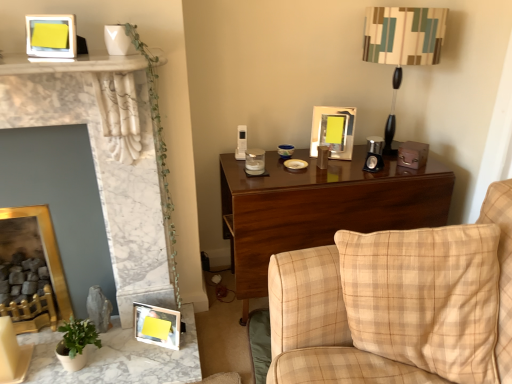
Measure the distance between point (167,313) and camera.

Point (167,313) and camera are 6.00 feet apart from each other.

This screenshot has height=384, width=512. What do you see at coordinates (402, 45) in the screenshot? I see `striped fabric lampshade at upper right` at bounding box center [402, 45].

At what (x,y) coordinates should I click in order to perform the action: click on marble table at lower left. Please return your answer as a coordinate pair (x, y). This screenshot has height=384, width=512. Looking at the image, I should click on (118, 358).

Where is `beige plaid fabric couch at right`? The width and height of the screenshot is (512, 384). beige plaid fabric couch at right is located at coordinates (396, 303).

Where is `metallic silver picture frame at upper center, the 2th picture frame positioned from the top`? The width and height of the screenshot is (512, 384). metallic silver picture frame at upper center, the 2th picture frame positioned from the top is located at coordinates (333, 131).

The width and height of the screenshot is (512, 384). In order to click on wooden photo frame at lower left, arranged as the first picture frame when ordered from the bottom in this screenshot , I will do `click(157, 325)`.

Is white marble fireplace at left next to marble table at lower left?

white marble fireplace at left and marble table at lower left are clearly separated.

In terms of height, does white marble fireplace at left look taller or shorter compared to marble table at lower left?

Clearly, white marble fireplace at left is taller compared to marble table at lower left.

What's the angular difference between white marble fireplace at left and marble table at lower left's facing directions?

white marble fireplace at left and marble table at lower left are facing 0.075 degrees away from each other.

Choose the correct answer: Is white marble fireplace at left inside marble table at lower left or outside it?

white marble fireplace at left is outside marble table at lower left.

Which object is further away from the camera, green leafy plant at upper left or striped fabric lampshade at upper right?

striped fabric lampshade at upper right is further away from the camera.

Is green leafy plant at upper left wider than striped fabric lampshade at upper right?

Incorrect, the width of green leafy plant at upper left does not surpass that of striped fabric lampshade at upper right.

Based on the photo, from the image's perspective, which object appears higher, green leafy plant at upper left or striped fabric lampshade at upper right?

striped fabric lampshade at upper right.

Is green leafy plant at upper left next to gold/gilded picture frame at lower left, the first picture frame from the left, and touching it?

green leafy plant at upper left and gold/gilded picture frame at lower left, the first picture frame from the left, are clearly separated.

Based on their sizes in the image, would you say green leafy plant at upper left is bigger or smaller than gold/gilded picture frame at lower left, the 3th picture frame positioned from the top?

Considering their sizes, green leafy plant at upper left takes up less space than gold/gilded picture frame at lower left, the 3th picture frame positioned from the top.

Is green leafy plant at upper left taller than gold/gilded picture frame at lower left, placed as the 2th picture frame when sorted from bottom to top?

Yes, green leafy plant at upper left is taller than gold/gilded picture frame at lower left, placed as the 2th picture frame when sorted from bottom to top.

From a real-world perspective, is green leafy plant at upper left below gold/gilded picture frame at lower left, which is counted as the fourth picture frame, starting from the right?

No.

Is yellow matte picture frame at upper left, which is the second picture frame in left-to-right order, oriented away from striped fabric lampshade at upper right?

No, yellow matte picture frame at upper left, which is the second picture frame in left-to-right order,'s orientation is not away from striped fabric lampshade at upper right.

Considering the sizes of yellow matte picture frame at upper left, which ranks as the 4th picture frame in bottom-to-top order, and striped fabric lampshade at upper right in the image, is yellow matte picture frame at upper left, which ranks as the 4th picture frame in bottom-to-top order, wider or thinner than striped fabric lampshade at upper right?

yellow matte picture frame at upper left, which ranks as the 4th picture frame in bottom-to-top order, is thinner than striped fabric lampshade at upper right.

From a real-world perspective, is yellow matte picture frame at upper left, which ranks as the 4th picture frame in bottom-to-top order, physically located above or below striped fabric lampshade at upper right?

Clearly, from a real-world perspective, yellow matte picture frame at upper left, which ranks as the 4th picture frame in bottom-to-top order, is above striped fabric lampshade at upper right.

Does point (30, 38) come in front of point (391, 133)?

Yes, point (30, 38) is closer to viewer.

Is gold/gilded picture frame at lower left, the first picture frame from the left, positioned before yellow matte picture frame at upper left, which is the second picture frame in left-to-right order?

No, gold/gilded picture frame at lower left, the first picture frame from the left, is behind yellow matte picture frame at upper left, which is the second picture frame in left-to-right order.

Who is bigger, gold/gilded picture frame at lower left, the 3th picture frame positioned from the top, or yellow matte picture frame at upper left, placed as the third picture frame when sorted from right to left?

gold/gilded picture frame at lower left, the 3th picture frame positioned from the top.

How distant is gold/gilded picture frame at lower left, which is counted as the fourth picture frame, starting from the right, from yellow matte picture frame at upper left, which is the second picture frame in left-to-right order?

gold/gilded picture frame at lower left, which is counted as the fourth picture frame, starting from the right, and yellow matte picture frame at upper left, which is the second picture frame in left-to-right order, are 94.18 centimeters apart from each other.

Who is shorter, wooden photo frame at lower left, which is counted as the second picture frame, starting from the right, or beige plaid fabric couch at right?

With less height is wooden photo frame at lower left, which is counted as the second picture frame, starting from the right.

Is wooden photo frame at lower left, the fourth picture frame positioned from the top, positioned far away from beige plaid fabric couch at right?

wooden photo frame at lower left, the fourth picture frame positioned from the top, is near beige plaid fabric couch at right, not far away.

The width and height of the screenshot is (512, 384). Identify the location of table lamp located above the metallic silver picture frame at upper center, positioned as the 4th picture frame in left-to-right order (from a real-world perspective). (402, 45).

Which is less distant, (371, 57) or (331, 115)?

Point (371, 57)

Locate an element on the screen. The width and height of the screenshot is (512, 384). fireplace above the marble table at lower left (from the image's perspective) is located at coordinates (103, 156).

Image resolution: width=512 pixels, height=384 pixels. What are the coordinates of `plant on the left side of striped fabric lampshade at upper right` in the screenshot? It's located at (159, 153).

Looking at the image, which one is located closer to striped fabric lampshade at upper right, marble table at lower left or yellow matte picture frame at upper left, the first picture frame from the top?

yellow matte picture frame at upper left, the first picture frame from the top.

When comparing their distances from yellow matte picture frame at upper left, which is the second picture frame in left-to-right order, does metallic silver picture frame at upper center, positioned as the 4th picture frame in left-to-right order, or white marble fireplace at left seem closer?

white marble fireplace at left lies closer to yellow matte picture frame at upper left, which is the second picture frame in left-to-right order, than the other object.

Looking at the image, which one is located further to beige plaid fabric couch at right, metallic silver picture frame at upper center, which is the 3th picture frame from bottom to top, or wooden photo frame at lower left, arranged as the first picture frame when ordered from the bottom?

metallic silver picture frame at upper center, which is the 3th picture frame from bottom to top, is further to beige plaid fabric couch at right.

Estimate the real-world distances between objects in this image. Which object is further from white marble fireplace at left, dark wood desk at center or striped fabric lampshade at upper right?

striped fabric lampshade at upper right is further to white marble fireplace at left.

Which object lies nearer to the anchor point wooden photo frame at lower left, which is counted as the second picture frame, starting from the right, striped fabric lampshade at upper right or marble table at lower left?

Among the two, marble table at lower left is located nearer to wooden photo frame at lower left, which is counted as the second picture frame, starting from the right.

From the image, which object appears to be farther from marble table at lower left, gold/gilded picture frame at lower left, which is counted as the fourth picture frame, starting from the right, or beige plaid fabric couch at right?

beige plaid fabric couch at right is further to marble table at lower left.

When comparing their distances from wooden photo frame at lower left, arranged as the first picture frame when ordered from the bottom, does beige plaid fabric couch at right or green matte plant at lower left seem closer?

green matte plant at lower left.

When comparing their distances from marble table at lower left, does white marble fireplace at left or striped fabric lampshade at upper right seem closer?

white marble fireplace at left is closer to marble table at lower left.

At what (x,y) coordinates should I click in order to perform the action: click on plant between wooden photo frame at lower left, the fourth picture frame positioned from the top, and dark wood desk at center. Please return your answer as a coordinate pair (x, y). The height and width of the screenshot is (384, 512). Looking at the image, I should click on (159, 153).

Where is `table situated between green matte plant at lower left and beige plaid fabric couch at right from left to right`? This screenshot has width=512, height=384. table situated between green matte plant at lower left and beige plaid fabric couch at right from left to right is located at coordinates (118, 358).

Where is `studio couch located between green leafy plant at upper left and striped fabric lampshade at upper right in the left-right direction`? Image resolution: width=512 pixels, height=384 pixels. studio couch located between green leafy plant at upper left and striped fabric lampshade at upper right in the left-right direction is located at coordinates (396, 303).

This screenshot has height=384, width=512. Find the location of `picture frame located between green leafy plant at upper left and dark wood desk at center in the left-right direction`. picture frame located between green leafy plant at upper left and dark wood desk at center in the left-right direction is located at coordinates (333, 131).